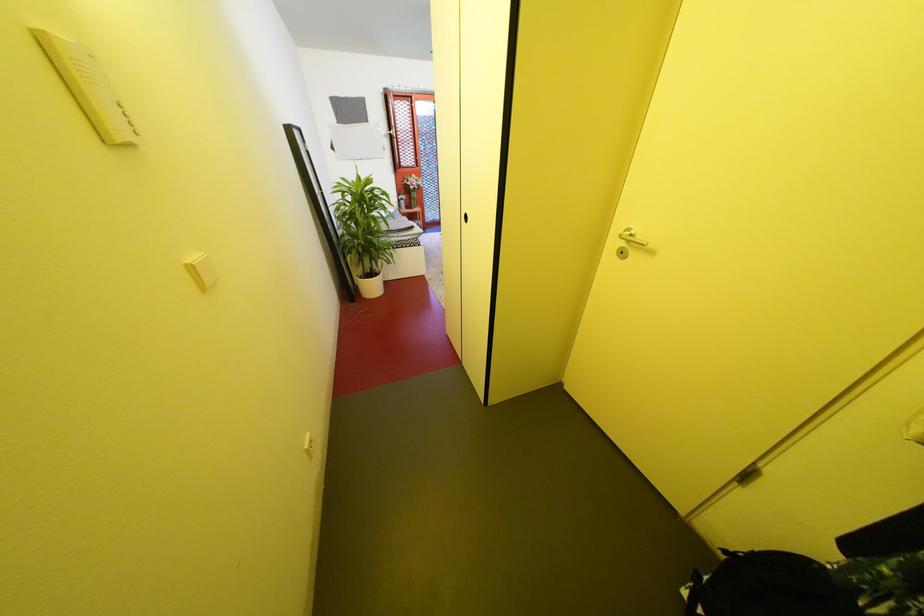
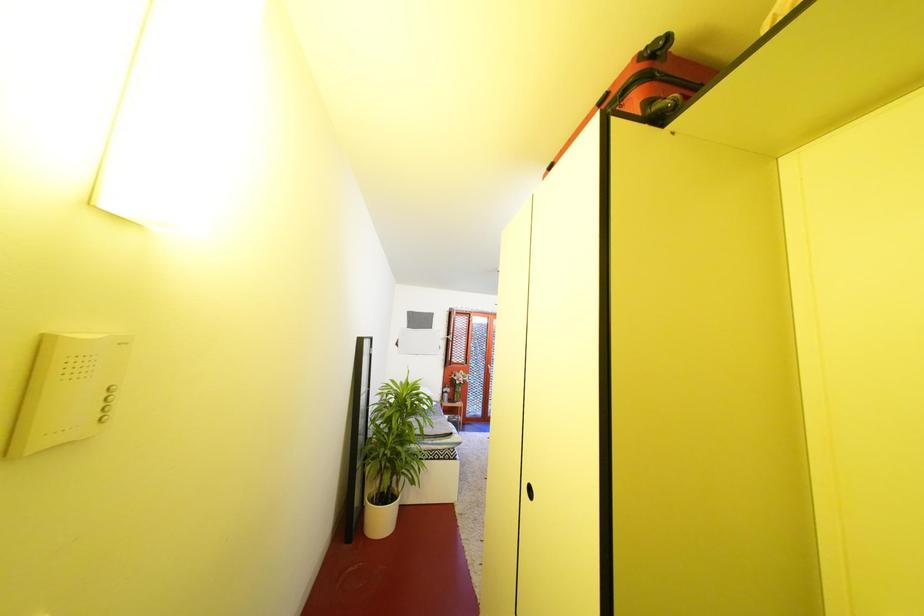
Question: How did the camera likely rotate?

Choices:
 (A) Left
 (B) Right
 (C) Up
 (D) Down

Answer: (C)